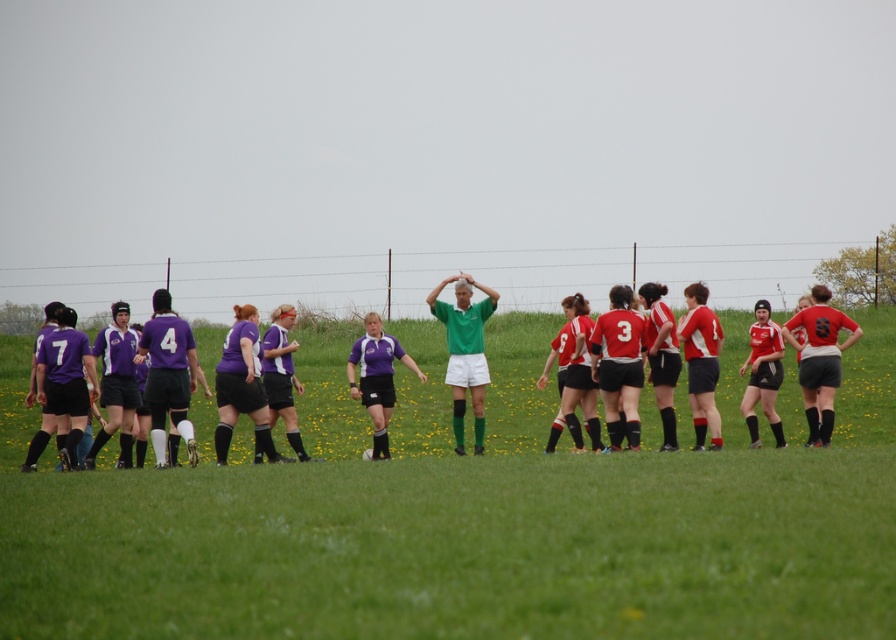
You are a photographer standing at the edge of the field. You want to take a photo that includes both the matte purple jersey at center and the green matte jersey at center. Based on their positions, which jersey should you focus on first to ensure both are in frame?

The matte purple jersey at center is located above the green matte jersey at center, so you should focus on the green matte jersey at center first to ensure both are in frame.

You are a photographer standing at the edge of the field. You want to take a photo that includes both the point at coordinates point (254, 376) and the point at coordinates point (445, 314). Which point will appear larger in your photo?

The point at coordinates point (254, 376) will appear larger in the photo because it is closer to the viewer than the point at coordinates point (445, 314).

You are a sports photographer standing at the edge of the field. You want to take a photo of both the purple jersey at left and the green matte jersey at center in the same frame. What is the minimum distance you need to move backward to ensure both are fully visible?

The purple jersey at left is 8.54 meters from the green matte jersey at center. To capture both in the same frame, you need to move back at least 8.54 meters to ensure the entire distance between them fits within your camera view.